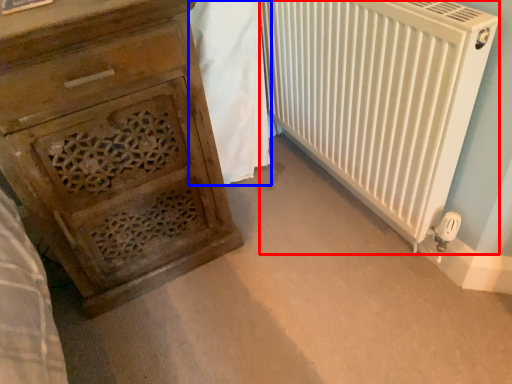
Question: Among these objects, which one is nearest to the camera, radiator (highlighted by a red box) or blanket (highlighted by a blue box)?

Choices:
 (A) radiator
 (B) blanket

Answer: (A)